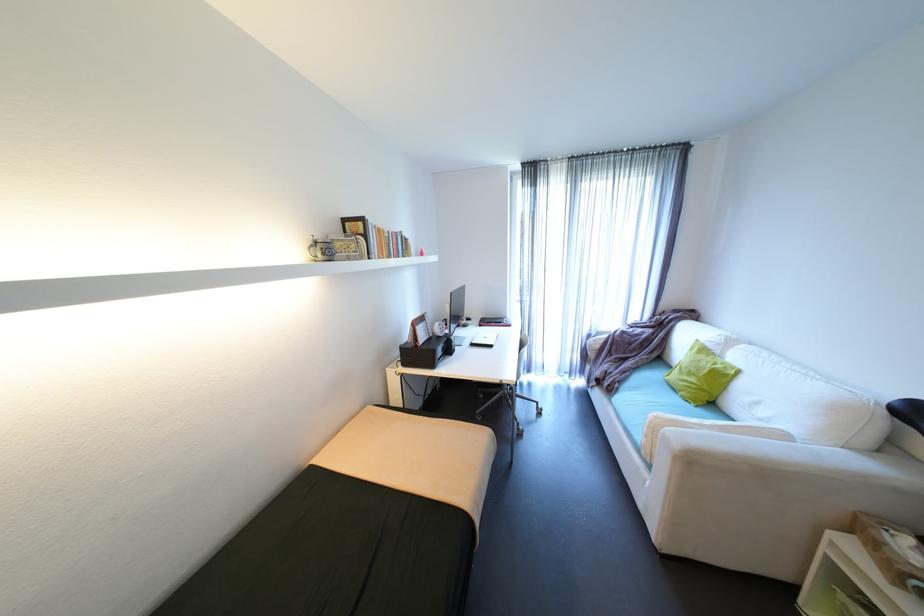
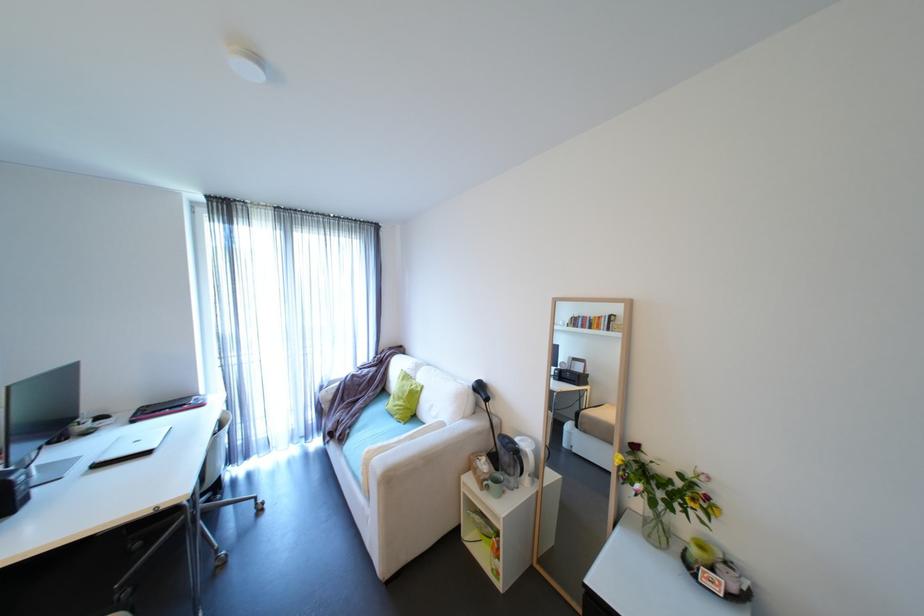
Question: I am providing you with two images of the same scene from different viewpoints. After the viewpoint changes to image2, which objects are now occluded?

Choices:
 (A) white pillow
 (B) green mug
 (C) glass flower vase
 (D) none of these

Answer: (D)